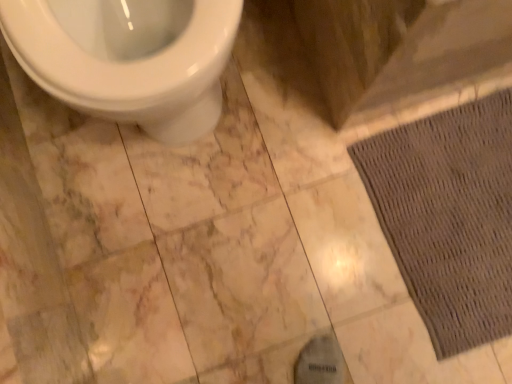
Question: Can you confirm if white glossy toilet at upper left is thinner than brown textured mat at lower right?

Choices:
 (A) no
 (B) yes

Answer: (B)

Question: Is white glossy toilet at upper left at the right side of brown textured mat at lower right?

Choices:
 (A) no
 (B) yes

Answer: (A)

Question: Is white glossy toilet at upper left to the left of brown textured mat at lower right from the viewer's perspective?

Choices:
 (A) no
 (B) yes

Answer: (B)

Question: Does white glossy toilet at upper left have a lesser height compared to brown textured mat at lower right?

Choices:
 (A) yes
 (B) no

Answer: (B)

Question: From a real-world perspective, is white glossy toilet at upper left located higher than brown textured mat at lower right?

Choices:
 (A) yes
 (B) no

Answer: (A)

Question: From the image's perspective, does white glossy toilet at upper left appear higher than brown textured mat at lower right?

Choices:
 (A) no
 (B) yes

Answer: (B)

Question: Can you confirm if brown textured mat at lower right is shorter than white glossy toilet at upper left?

Choices:
 (A) yes
 (B) no

Answer: (A)

Question: From a real-world perspective, is brown textured mat at lower right under white glossy toilet at upper left?

Choices:
 (A) no
 (B) yes

Answer: (B)

Question: Can you confirm if brown textured mat at lower right is thinner than white glossy toilet at upper left?

Choices:
 (A) yes
 (B) no

Answer: (B)

Question: Considering the relative positions of brown textured mat at lower right and white glossy toilet at upper left in the image provided, is brown textured mat at lower right to the right of white glossy toilet at upper left from the viewer's perspective?

Choices:
 (A) no
 (B) yes

Answer: (B)

Question: From the image's perspective, is brown textured mat at lower right above white glossy toilet at upper left?

Choices:
 (A) no
 (B) yes

Answer: (A)

Question: Considering the relative sizes of brown textured mat at lower right and white glossy toilet at upper left in the image provided, is brown textured mat at lower right wider than white glossy toilet at upper left?

Choices:
 (A) no
 (B) yes

Answer: (B)

Question: In the image, is white glossy toilet at upper left on the left side or the right side of brown textured mat at lower right?

Choices:
 (A) left
 (B) right

Answer: (A)